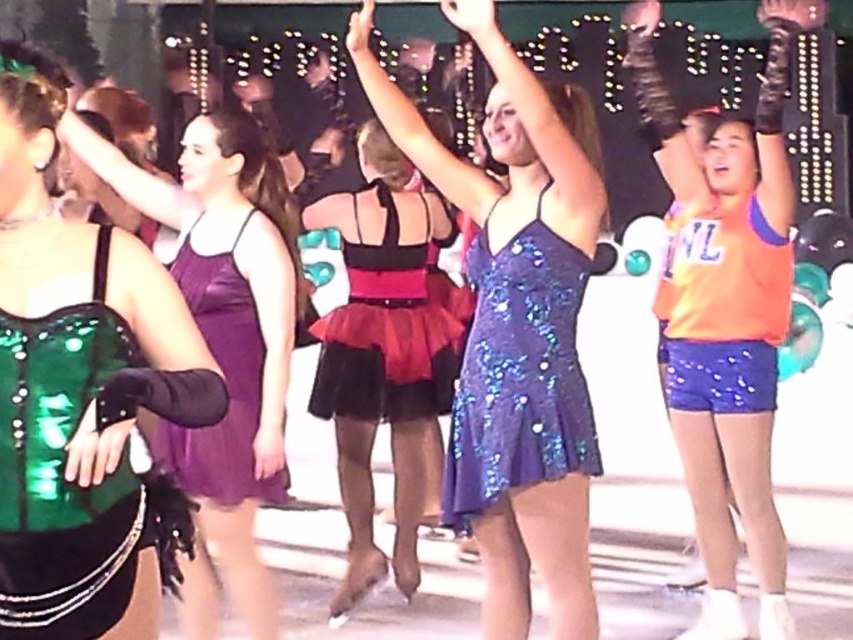
You are a photographer at the event and want to capture a clear photo of the shiny blue sequined dress at center. However, the shiny black dress at center is blocking your view. Based on the scene description, can you adjust your position to take the photo without moving any people?

Yes, since the shiny blue sequined dress at center is in front of the shiny black dress at center, you can position yourself so that the shiny blue sequined dress at center is visible while the shiny black dress at center is behind it and not obstructing the view.

You are a photographer at the event and want to ensure both the green shiny corset at left and the purple sequined dress at center are visible in your photo. Given their heights, which one should you focus on to frame the shot properly?

The green shiny corset at left is taller than the purple sequined dress at center, so focusing on the green shiny corset at left will help frame the shot properly to include both.